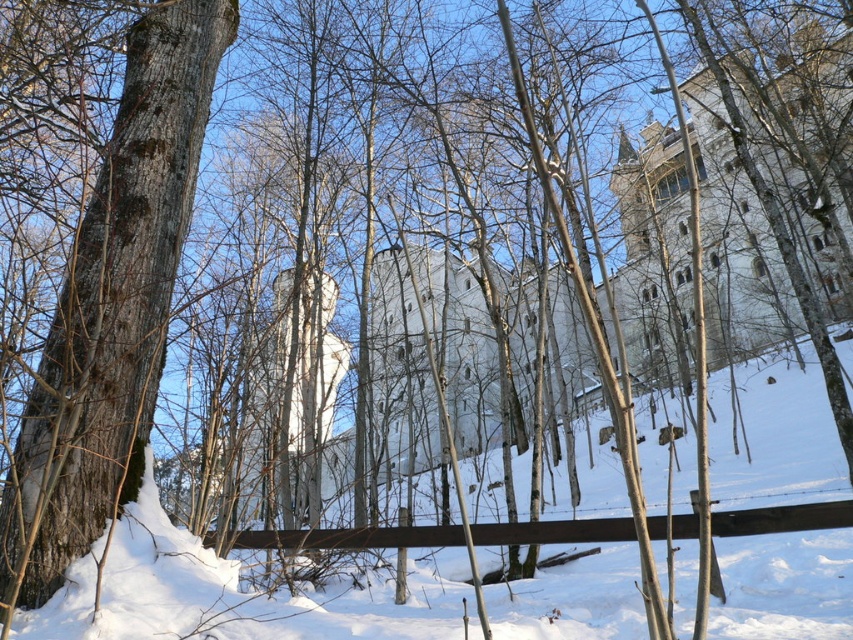
Question: Among these objects, which one is farthest from the camera?

Choices:
 (A) white powdery snow at center
 (B) smooth bark tree at left

Answer: (A)

Question: Does white powdery snow at center have a lesser width compared to smooth bark tree at left?

Choices:
 (A) no
 (B) yes

Answer: (A)

Question: In this image, where is white powdery snow at center located relative to smooth bark tree at left?

Choices:
 (A) left
 (B) right

Answer: (B)

Question: Which point is farther from the camera taking this photo?

Choices:
 (A) (103, 520)
 (B) (680, 628)

Answer: (B)

Question: Does white powdery snow at center come behind smooth bark tree at left?

Choices:
 (A) no
 (B) yes

Answer: (B)